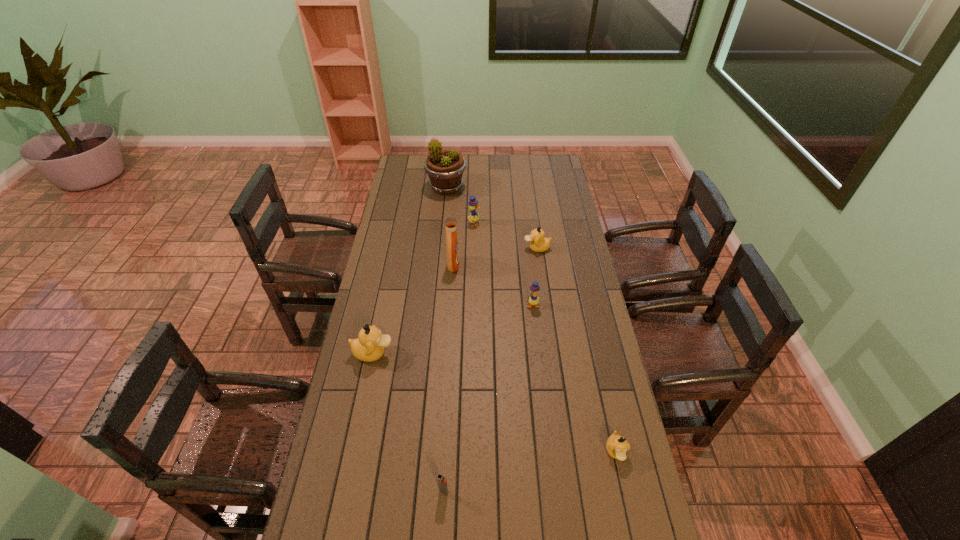
The image size is (960, 540). Identify the location of the farthest object. (445, 168).

Image resolution: width=960 pixels, height=540 pixels. In order to click on the tallest object in this screenshot , I will do `click(445, 168)`.

At what (x,y) coordinates should I click in order to perform the action: click on the second tallest object. Please return your answer as a coordinate pair (x, y). This screenshot has width=960, height=540. Looking at the image, I should click on (450, 223).

I want to click on detergent, so click(x=450, y=223).

Locate an element on the screen. the biggest tan duckling is located at coordinates (369, 346).

Locate an element on the screen. This screenshot has height=540, width=960. the leftmost object is located at coordinates (369, 346).

Image resolution: width=960 pixels, height=540 pixels. What are the coordinates of `the fifth object from left to right` in the screenshot? It's located at (473, 204).

Locate an element on the screen. the farther yellow duckling is located at coordinates (473, 204).

The height and width of the screenshot is (540, 960). I want to click on the second tan duckling from right to left, so click(538, 243).

Locate an element on the screen. The width and height of the screenshot is (960, 540). the sixth nearest object is located at coordinates (538, 243).